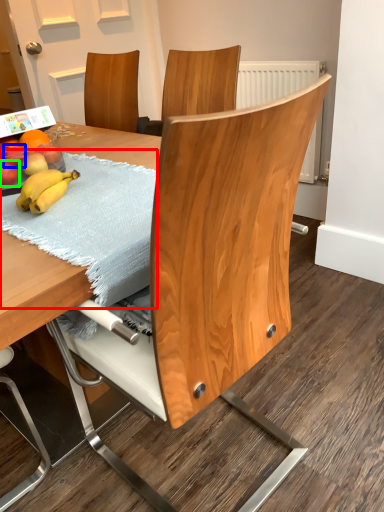
Question: Considering the real-world distances, which object is closest to blanket (highlighted by a red box)? apple (highlighted by a blue box) or apple (highlighted by a green box).

Choices:
 (A) apple
 (B) apple

Answer: (B)